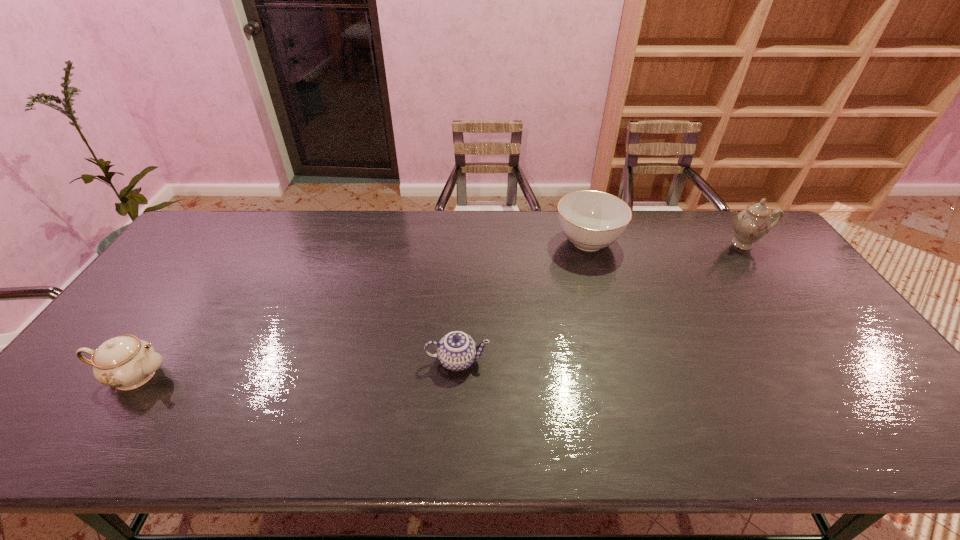
Where is `the tallest object`? the tallest object is located at coordinates (750, 225).

The image size is (960, 540). Identify the location of the tallest chinaware. (750, 225).

This screenshot has height=540, width=960. In order to click on the second object from right to left in this screenshot , I will do `click(592, 220)`.

I want to click on the leftmost object, so click(125, 362).

Locate an element on the screen. the shortest object is located at coordinates (457, 350).

You are a GUI agent. You are given a task and a screenshot of the screen. Output one action in this format:
    pyautogui.click(x=<x>, y=<y>)
    Task: Click on the second chinaware from left to right
    The image size is (960, 540).
    Given the screenshot: What is the action you would take?
    pyautogui.click(x=457, y=350)

Where is `free point located on the spout of the tallest object`? free point located on the spout of the tallest object is located at coordinates (767, 278).

You are a GUI agent. You are given a task and a screenshot of the screen. Output one action in this format:
    pyautogui.click(x=<x>, y=<y>)
    Task: Click on the free space located on the right of the second object from right to left
    The image size is (960, 540).
    Given the screenshot: What is the action you would take?
    pyautogui.click(x=726, y=241)

The width and height of the screenshot is (960, 540). What are the coordinates of `vacant space located at the spout of the leftmost object` in the screenshot? It's located at (289, 375).

At what (x,y) coordinates should I click in order to perform the action: click on vacant region located from the spout of the shortest chinaware. Please return your answer as a coordinate pair (x, y). This screenshot has width=960, height=540. Looking at the image, I should click on (540, 361).